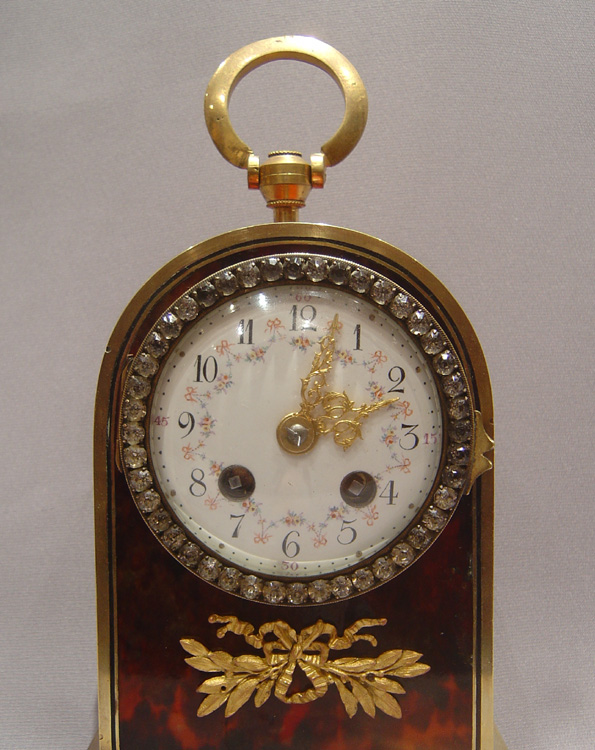
The height and width of the screenshot is (750, 595). I want to click on white clock face, so click(x=263, y=424).